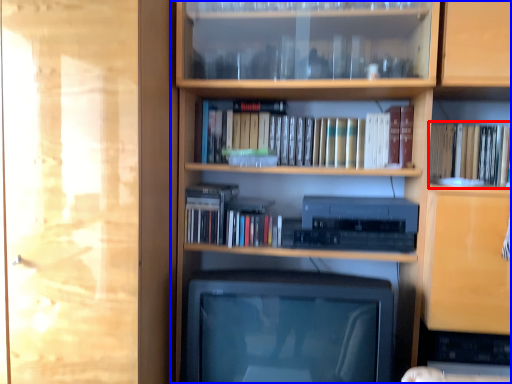
Question: Which object is further to the camera taking this photo, book (highlighted by a red box) or bookcase (highlighted by a blue box)?

Choices:
 (A) book
 (B) bookcase

Answer: (A)